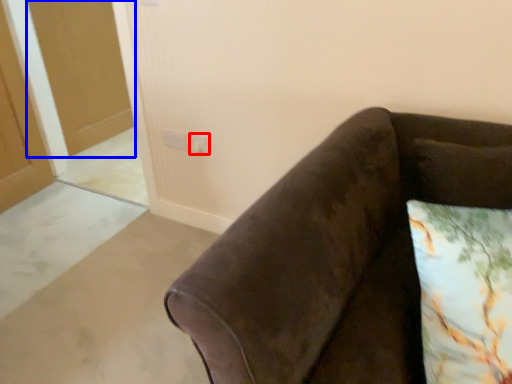
Question: Which object appears closest to the camera in this image, electric outlet (highlighted by a red box) or glass door (highlighted by a blue box)?

Choices:
 (A) electric outlet
 (B) glass door

Answer: (A)